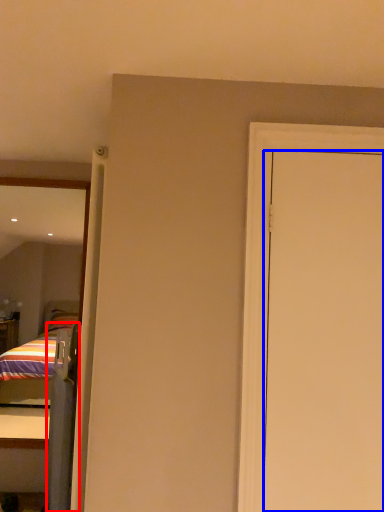
Question: Which point is closer to the camera, screen door (highlighted by a red box) or door (highlighted by a blue box)?

Choices:
 (A) screen door
 (B) door

Answer: (B)